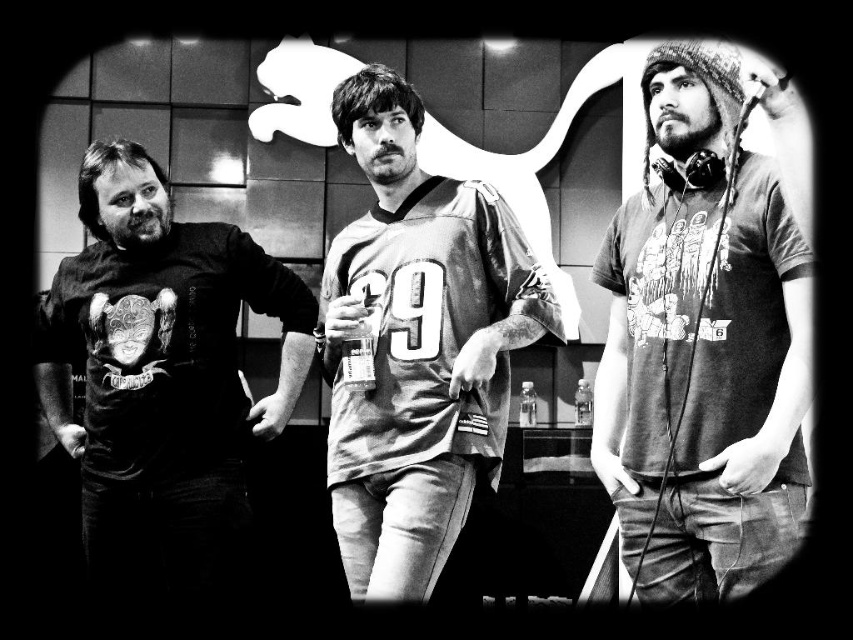
Question: Does matte gray t-shirt at right appear over metallic jersey at center?

Choices:
 (A) no
 (B) yes

Answer: (A)

Question: Is matte gray t-shirt at right further to camera compared to metallic jersey at center?

Choices:
 (A) no
 (B) yes

Answer: (A)

Question: Among these points, which one is nearest to the camera?

Choices:
 (A) (657, 568)
 (B) (357, 404)
 (C) (223, 548)

Answer: (A)

Question: Which object is farther from the camera taking this photo?

Choices:
 (A) matte black t-shirt at left
 (B) metallic jersey at center
 (C) matte gray t-shirt at right

Answer: (A)

Question: Which point is farther from the camera taking this photo?

Choices:
 (A) (619, 294)
 (B) (245, 465)

Answer: (B)

Question: Does matte gray t-shirt at right have a lesser width compared to matte black t-shirt at left?

Choices:
 (A) yes
 (B) no

Answer: (A)